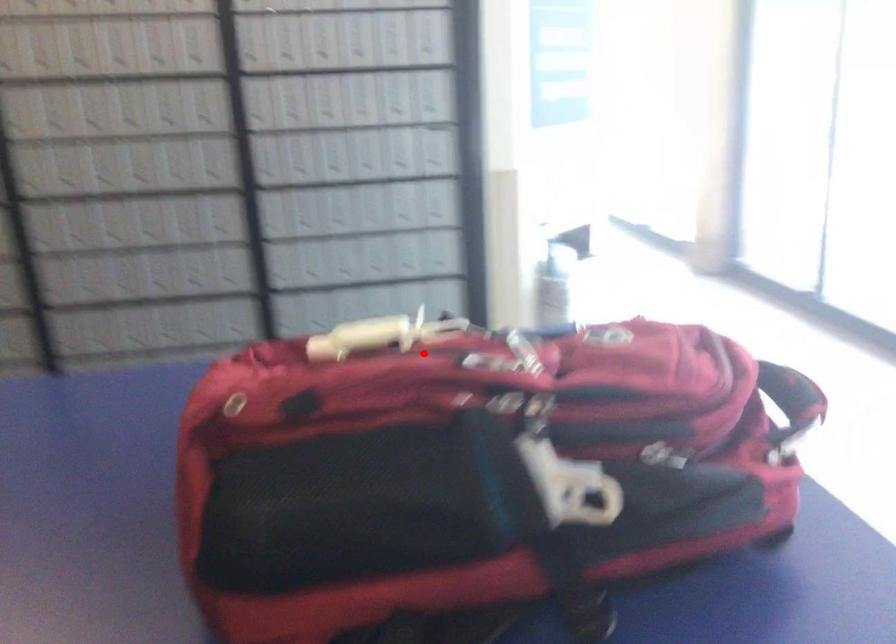
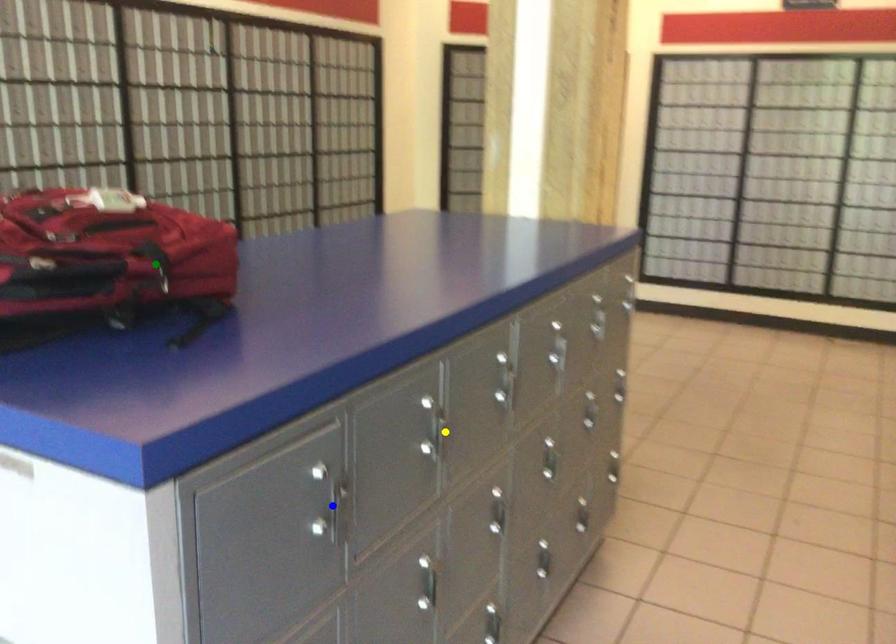
Question: I am providing you with two images of the same scene from different viewpoints. A red point is marked on the first image. You are given multiple points on the second image. Can you choose the point in image 2 that corresponds to the point in image 1?

Choices:
 (A) yellow point
 (B) blue point
 (C) green point

Answer: (C)